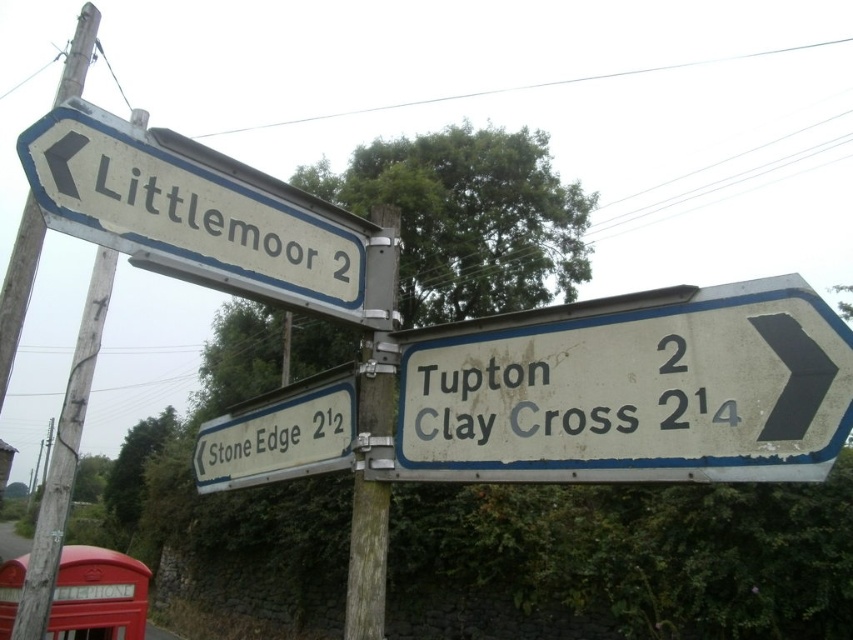
Question: Which point is closer to the camera?

Choices:
 (A) coord(296,474)
 (B) coord(12,362)
 (C) coord(100,118)

Answer: (C)

Question: Is white faded sign at right positioned at the back of white plastic sign at left?

Choices:
 (A) no
 (B) yes

Answer: (A)

Question: Which is farther from the red painted metal telephone box at lower left?

Choices:
 (A) white plastic sign at left
 (B) white faded sign at right

Answer: (A)

Question: Which object appears farthest from the camera in this image?

Choices:
 (A) white faded sign at right
 (B) wooden post at center

Answer: (B)

Question: Does red painted metal telephone box at lower left have a lesser width compared to wooden pole at left?

Choices:
 (A) no
 (B) yes

Answer: (B)

Question: Considering the relative positions of white faded sign at right and red painted metal telephone box at lower left in the image provided, where is white faded sign at right located with respect to red painted metal telephone box at lower left?

Choices:
 (A) right
 (B) left

Answer: (A)